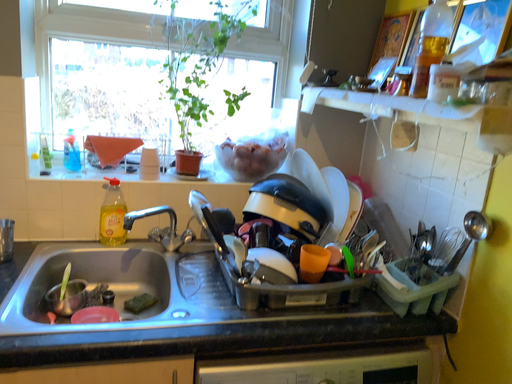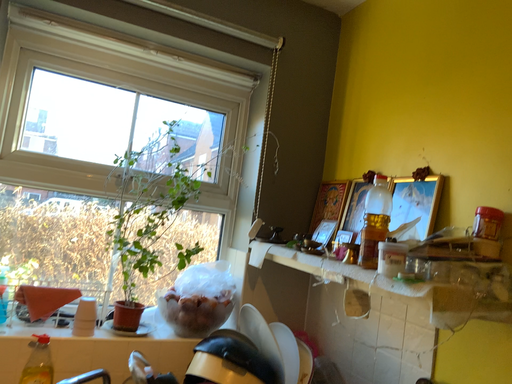
Question: Which way did the camera rotate in the video?

Choices:
 (A) rotated upward
 (B) rotated downward

Answer: (A)